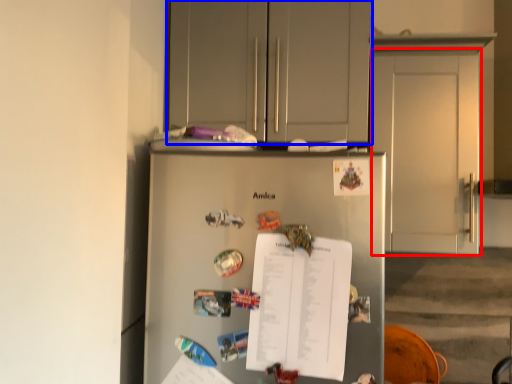
Question: Which of the following is the closest to the observer, door (highlighted by a red box) or cabinetry (highlighted by a blue box)?

Choices:
 (A) door
 (B) cabinetry

Answer: (A)